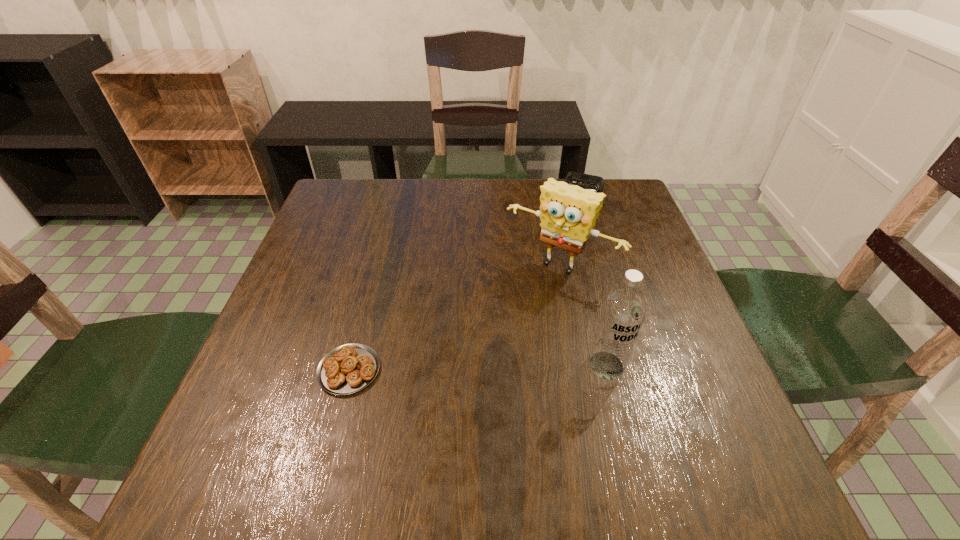
The height and width of the screenshot is (540, 960). In the image, there is a desktop. Find the location of `free space at the left edge`. free space at the left edge is located at coordinates (300, 262).

You are a GUI agent. You are given a task and a screenshot of the screen. Output one action in this format:
    pyautogui.click(x=<x>, y=<y>)
    Task: Click on the vacant space at the right edge of the desktop
    The height and width of the screenshot is (540, 960).
    Given the screenshot: What is the action you would take?
    pyautogui.click(x=660, y=311)

Find the location of a particular element. free region at the far left corner of the desktop is located at coordinates (334, 185).

Identify the location of vacant space at the far right corner of the desktop. This screenshot has height=540, width=960. (631, 206).

The image size is (960, 540). In order to click on free spot between the third nearest object and the vodka in this screenshot , I will do `click(583, 315)`.

The width and height of the screenshot is (960, 540). Find the location of `empty location between the vodka and the pastry`. empty location between the vodka and the pastry is located at coordinates (478, 368).

I want to click on free space between the vodka and the leftmost object, so click(478, 368).

Image resolution: width=960 pixels, height=540 pixels. Find the location of `free space between the vodka and the farthest object`. free space between the vodka and the farthest object is located at coordinates (594, 276).

The image size is (960, 540). In order to click on empty space that is in between the farthest object and the vodka in this screenshot , I will do `click(594, 276)`.

At what (x,y) coordinates should I click in order to perform the action: click on free spot between the farthest object and the vodka. Please return your answer as a coordinate pair (x, y). This screenshot has height=540, width=960. Looking at the image, I should click on (594, 276).